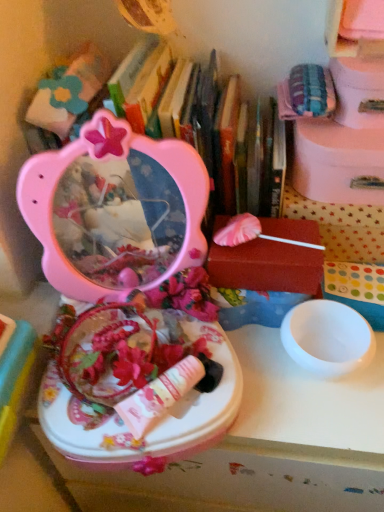
The width and height of the screenshot is (384, 512). I want to click on vacant area that is in front of pink matte lollipop at center, which ranks as the 4th storage box in top-to-bottom order, so click(288, 392).